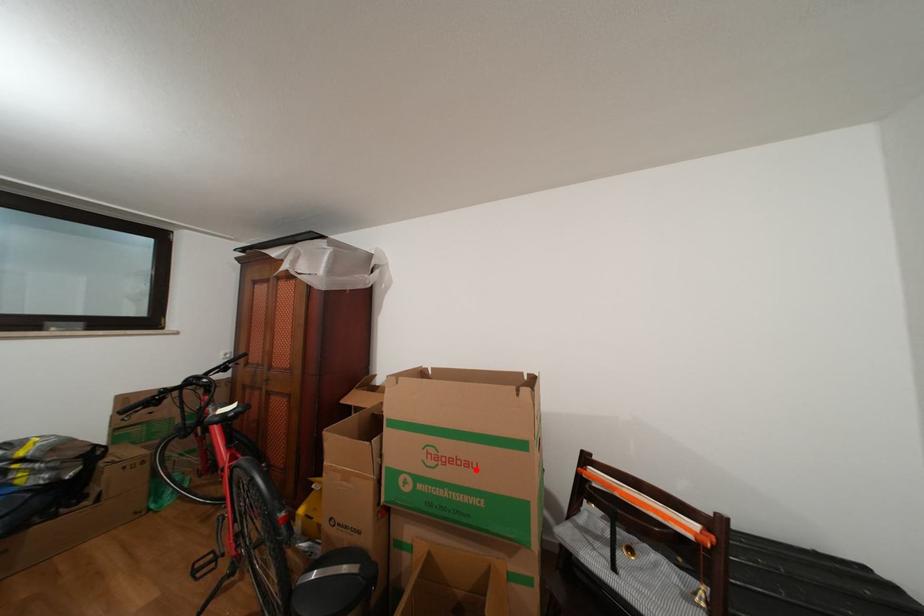
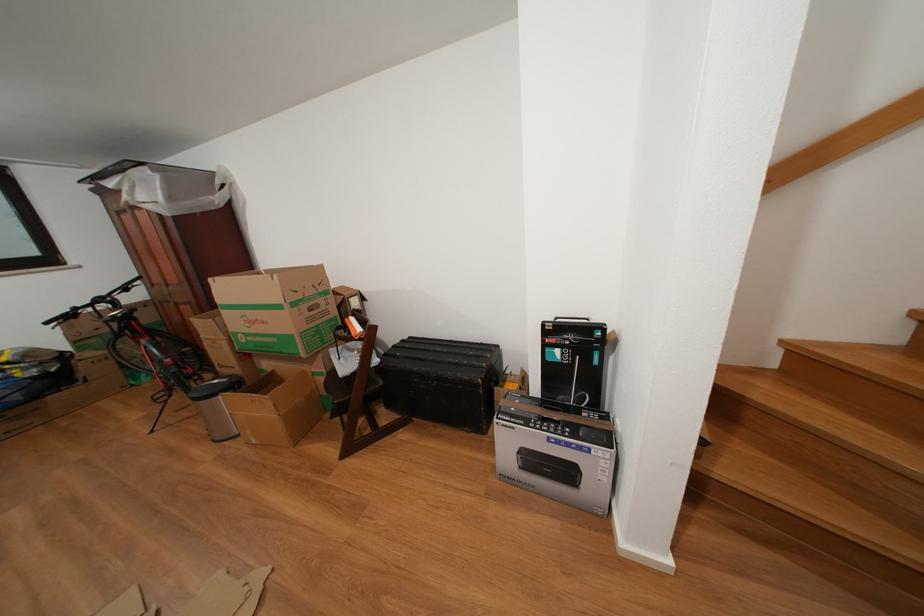
Find the pixel in the second image that matches the highlighted location in the first image.

(272, 328)